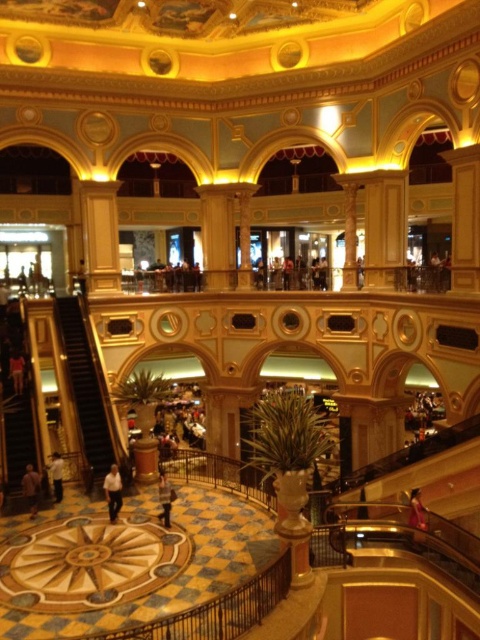
Question: Which object is the farthest from the brown leather jacket at lower left?

Choices:
 (A) pink fabric person at lower right
 (B) light brown leather jacket at center

Answer: (A)

Question: Which of the following is the farthest from the observer?

Choices:
 (A) white matte shirt at lower left
 (B) white shirt at center
 (C) light brown leather jacket at center

Answer: (A)

Question: Does metallic gold escalator at left have a larger size compared to white matte shirt at lower left?

Choices:
 (A) yes
 (B) no

Answer: (A)

Question: Can you confirm if brown leather jacket at lower left is positioned above white matte shirt at lower left?

Choices:
 (A) yes
 (B) no

Answer: (B)

Question: Among these points, which one is nearest to the camera?

Choices:
 (A) (72, 385)
 (B) (52, 483)
 (C) (163, 515)

Answer: (C)

Question: Does metallic gold escalator at left appear on the left side of pink fabric person at lower right?

Choices:
 (A) yes
 (B) no

Answer: (A)